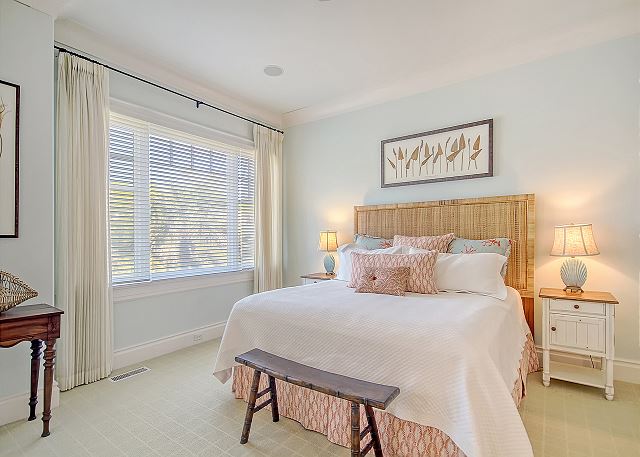
Where is `pillows and cushions on the bed`? The width and height of the screenshot is (640, 457). pillows and cushions on the bed is located at coordinates (374, 277), (401, 262), (464, 265), (473, 247), (429, 240), (345, 269), (371, 239).